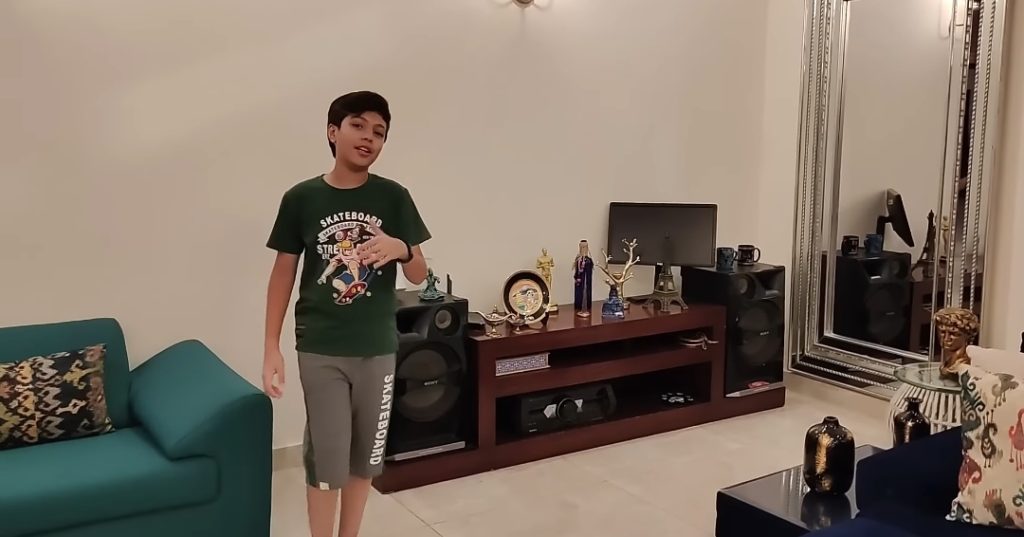
Where is `pillow`? This screenshot has height=537, width=1024. pillow is located at coordinates (56, 407).